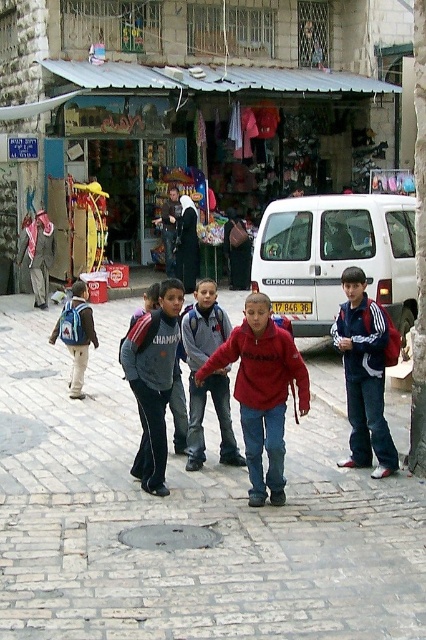
Is red matte sweatshirt at center to the right of matte blue backpack at left from the viewer's perspective?

Indeed, red matte sweatshirt at center is positioned on the right side of matte blue backpack at left.

Can you confirm if red matte sweatshirt at center is smaller than matte blue backpack at left?

No, red matte sweatshirt at center is not smaller than matte blue backpack at left.

Does point (247, 428) come closer to viewer compared to point (89, 324)?

Yes, point (247, 428) is in front of point (89, 324).

Where is `red matte sweatshirt at center`? The width and height of the screenshot is (426, 640). red matte sweatshirt at center is located at coordinates (261, 392).

Between blue fabric jacket at center and matte blue backpack at left, which one is positioned lower?

Positioned lower is blue fabric jacket at center.

Is blue fabric jacket at center to the right of matte blue backpack at left from the viewer's perspective?

Indeed, blue fabric jacket at center is positioned on the right side of matte blue backpack at left.

Is point (339, 328) more distant than point (75, 312)?

No, (339, 328) is closer to viewer.

This screenshot has height=640, width=426. What are the coordinates of `blue fabric jacket at center` in the screenshot? It's located at (365, 372).

Is metallic silver awning at center to the left of red matte jacket at center from the viewer's perspective?

No, metallic silver awning at center is not to the left of red matte jacket at center.

Consider the image. Can you confirm if metallic silver awning at center is wider than red matte jacket at center?

Indeed, metallic silver awning at center has a greater width compared to red matte jacket at center.

Who is more forward, (348, 96) or (222, 440)?

Positioned in front is point (222, 440).

Where is `metallic silver awning at center`? The width and height of the screenshot is (426, 640). metallic silver awning at center is located at coordinates (216, 132).